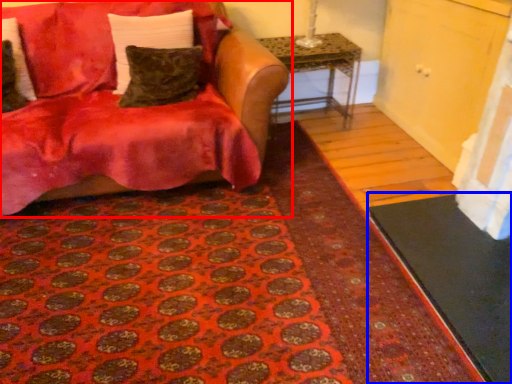
Question: Which object appears closest to the camera in this image, studio couch (highlighted by a red box) or doormat (highlighted by a blue box)?

Choices:
 (A) studio couch
 (B) doormat

Answer: (B)